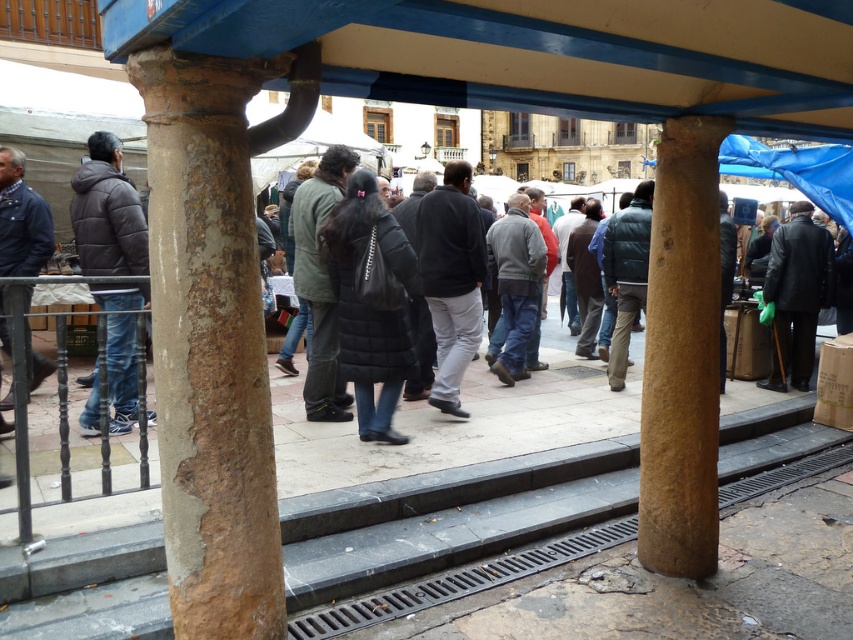
Question: Does rusty concrete pillar at left have a greater width compared to dark blue jacket at left?

Choices:
 (A) yes
 (B) no

Answer: (A)

Question: Is gray woolen sweater at center smaller than dark blue jacket at left?

Choices:
 (A) no
 (B) yes

Answer: (A)

Question: Considering the relative positions of dark brown puffy jacket at left and dark gray sweater at center in the image provided, where is dark brown puffy jacket at left located with respect to dark gray sweater at center?

Choices:
 (A) below
 (B) above

Answer: (A)

Question: Which point is farther to the camera?

Choices:
 (A) (666, 170)
 (B) (364, 368)
 (C) (0, 147)

Answer: (B)

Question: Which of these objects is positioned closest to the rusty stone pillar at center?

Choices:
 (A) gray woolen sweater at center
 (B) rusty concrete pillar at left
 (C) dark gray sweater at center

Answer: (B)

Question: Among these points, which one is farthest from the camera?

Choices:
 (A) (200, 497)
 (B) (331, 401)

Answer: (B)